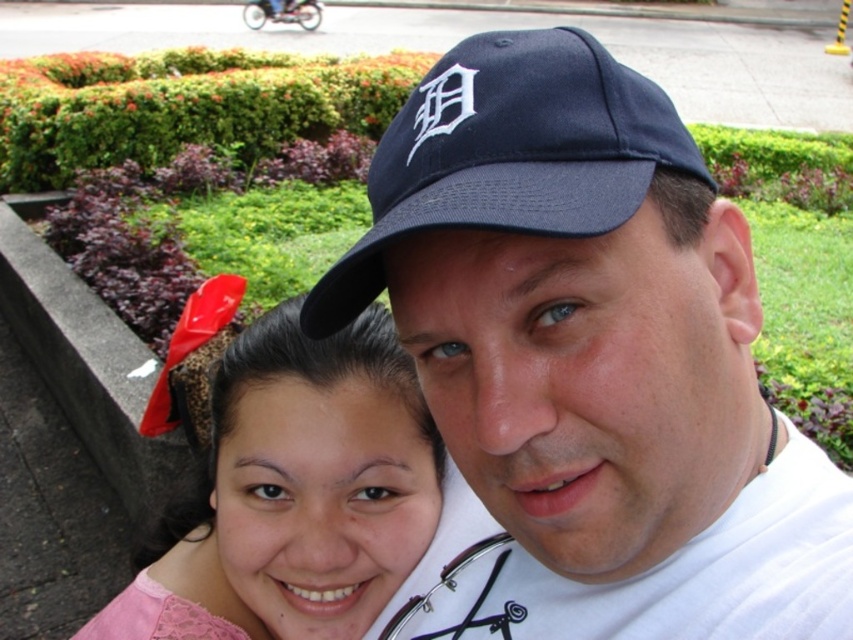
Question: Can you confirm if navy blue baseball cap at upper center is thinner than pink lace hairband at upper left?

Choices:
 (A) yes
 (B) no

Answer: (A)

Question: Estimate the real-world distances between objects in this image. Which object is farther from the navy blue baseball cap at upper center?

Choices:
 (A) pink lace hairband at upper left
 (B) navy blue fabric baseball cap at center

Answer: (A)

Question: Observing the image, what is the correct spatial positioning of navy blue baseball cap at upper center in reference to pink lace hairband at upper left?

Choices:
 (A) right
 (B) left

Answer: (A)

Question: Does navy blue baseball cap at upper center appear on the right side of pink lace hairband at upper left?

Choices:
 (A) yes
 (B) no

Answer: (A)

Question: Which object is the farthest from the navy blue fabric baseball cap at center?

Choices:
 (A) navy blue baseball cap at upper center
 (B) pink lace hairband at upper left

Answer: (B)

Question: Which object appears farthest from the camera in this image?

Choices:
 (A) navy blue baseball cap at upper center
 (B) pink lace hairband at upper left
 (C) navy blue fabric baseball cap at center

Answer: (B)